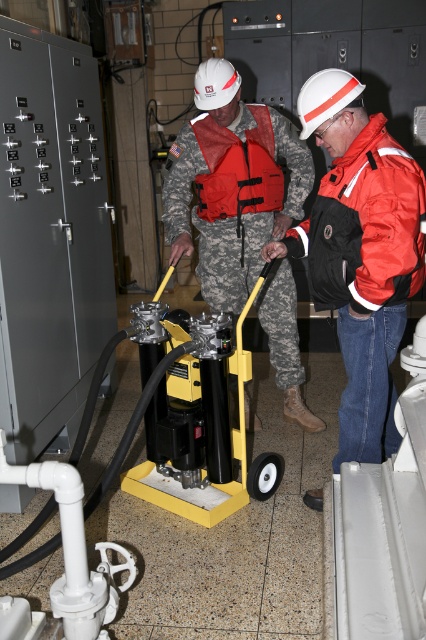
Question: Which point appears farthest from the camera in this image?

Choices:
 (A) (235, 141)
 (B) (324, 211)

Answer: (A)

Question: Is orange matte jacket at right wider than red fabric life vest at center?

Choices:
 (A) yes
 (B) no

Answer: (B)

Question: In this image, where is orange matte jacket at right located relative to red fabric life vest at center?

Choices:
 (A) left
 (B) right

Answer: (B)

Question: From the image, what is the correct spatial relationship of camouflage uniform at center in relation to red fabric life vest at center?

Choices:
 (A) left
 (B) right

Answer: (B)

Question: Which of the following is the closest to the observer?

Choices:
 (A) orange matte jacket at right
 (B) camouflage uniform at center
 (C) red fabric life vest at center

Answer: (A)

Question: Which point is closer to the camera?

Choices:
 (A) (400, 236)
 (B) (239, 157)

Answer: (A)